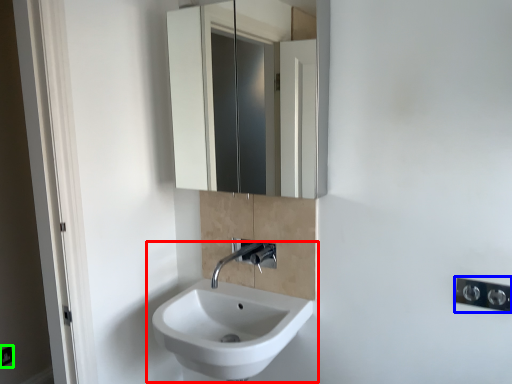
Question: Which object is positioned farthest from sink (highlighted by a red box)? Select from light switch (highlighted by a blue box) and electric outlet (highlighted by a green box).

Choices:
 (A) light switch
 (B) electric outlet

Answer: (B)